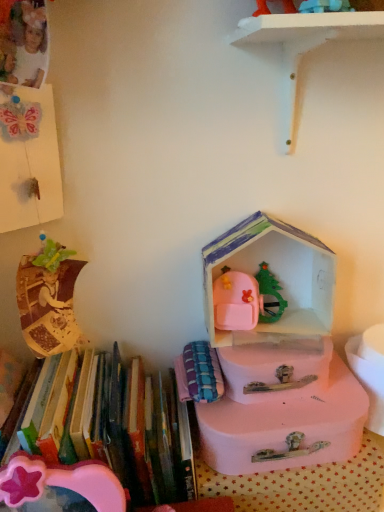
Find the location of `free space on the front side of pink plastic box at center`. free space on the front side of pink plastic box at center is located at coordinates (286, 420).